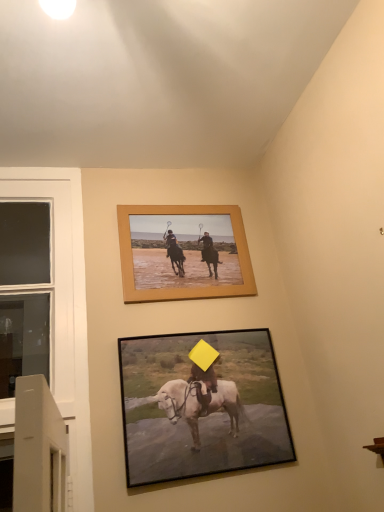
This screenshot has width=384, height=512. Describe the element at coordinates (201, 405) in the screenshot. I see `black matte picture frame at lower center, which is the first picture frame in bottom-to-top order` at that location.

Measure the distance between wooden frame at upper center, arranged as the second picture frame when ordered from the bottom, and camera.

wooden frame at upper center, arranged as the second picture frame when ordered from the bottom, is 1.41 meters away from camera.

I want to click on black matte picture frame at lower center, which is the first picture frame in bottom-to-top order, so click(x=201, y=405).

Is wooden frame at upper center, arranged as the second picture frame when ordered from the bottom, facing away from white glass window at left?

wooden frame at upper center, arranged as the second picture frame when ordered from the bottom, does not have its back to white glass window at left.

Is point (160, 288) in front of point (38, 289)?

Yes.

Is white glass window at left completely or partially inside wooden frame at upper center, the first picture frame positioned from the top?

No, white glass window at left is not inside wooden frame at upper center, the first picture frame positioned from the top.

Which object is positioned more to the left, wooden frame at upper center, the first picture frame positioned from the top, or white glass window at left?

white glass window at left.

In the scene shown: What's the angular difference between white glass window at left and black matte picture frame at lower center, the second picture frame positioned from the top,'s facing directions?

1.3 degrees.

Consider the image. From the image's perspective, between white glass window at left and black matte picture frame at lower center, which is the first picture frame in bottom-to-top order, who is located below?

black matte picture frame at lower center, which is the first picture frame in bottom-to-top order, from the image's perspective.

Which of these two, white glass window at left or black matte picture frame at lower center, which is the first picture frame in bottom-to-top order, stands shorter?

black matte picture frame at lower center, which is the first picture frame in bottom-to-top order, is shorter.

Which of these two, white glass window at left or black matte picture frame at lower center, the second picture frame positioned from the top, is thinner?

black matte picture frame at lower center, the second picture frame positioned from the top, is thinner.

From the image's perspective, is black matte picture frame at lower center, which is the first picture frame in bottom-to-top order, located above or below white glass window at left?

Clearly, from the image's perspective, black matte picture frame at lower center, which is the first picture frame in bottom-to-top order, is below white glass window at left.

Considering the sizes of objects black matte picture frame at lower center, which is the first picture frame in bottom-to-top order, and white glass window at left in the image provided, who is shorter, black matte picture frame at lower center, which is the first picture frame in bottom-to-top order, or white glass window at left?

Standing shorter between the two is black matte picture frame at lower center, which is the first picture frame in bottom-to-top order.

Is black matte picture frame at lower center, which is the first picture frame in bottom-to-top order, at the left side of wooden frame at upper center, the first picture frame positioned from the top?

No, black matte picture frame at lower center, which is the first picture frame in bottom-to-top order, is not to the left of wooden frame at upper center, the first picture frame positioned from the top.

Is there a large distance between black matte picture frame at lower center, which is the first picture frame in bottom-to-top order, and wooden frame at upper center, the first picture frame positioned from the top?

No.

Considering their positions, is black matte picture frame at lower center, which is the first picture frame in bottom-to-top order, located in front of or behind wooden frame at upper center, arranged as the second picture frame when ordered from the bottom?

Clearly, black matte picture frame at lower center, which is the first picture frame in bottom-to-top order, is in front of wooden frame at upper center, arranged as the second picture frame when ordered from the bottom.

From the image's perspective, relative to black matte picture frame at lower center, which is the first picture frame in bottom-to-top order, is wooden frame at upper center, arranged as the second picture frame when ordered from the bottom, above or below?

Based on their image positions, wooden frame at upper center, arranged as the second picture frame when ordered from the bottom, is located above black matte picture frame at lower center, which is the first picture frame in bottom-to-top order.

In the scene shown: Considering the relative positions of wooden frame at upper center, the first picture frame positioned from the top, and black matte picture frame at lower center, the second picture frame positioned from the top, in the image provided, is wooden frame at upper center, the first picture frame positioned from the top, in front of black matte picture frame at lower center, the second picture frame positioned from the top,?

No, the depth of wooden frame at upper center, the first picture frame positioned from the top, is greater than that of black matte picture frame at lower center, the second picture frame positioned from the top.

Looking at their sizes, would you say wooden frame at upper center, the first picture frame positioned from the top, is wider or thinner than black matte picture frame at lower center, which is the first picture frame in bottom-to-top order?

In the image, wooden frame at upper center, the first picture frame positioned from the top, appears to be more narrow than black matte picture frame at lower center, which is the first picture frame in bottom-to-top order.

In order to click on picture frame that is behind the black matte picture frame at lower center, which is the first picture frame in bottom-to-top order in this screenshot , I will do `click(183, 253)`.

Is white glass window at left aimed at wooden frame at upper center, the first picture frame positioned from the top?

No, white glass window at left is not facing towards wooden frame at upper center, the first picture frame positioned from the top.

Is white glass window at left positioned far away from wooden frame at upper center, arranged as the second picture frame when ordered from the bottom?

white glass window at left is actually quite close to wooden frame at upper center, arranged as the second picture frame when ordered from the bottom.

How different are the orientations of white glass window at left and wooden frame at upper center, arranged as the second picture frame when ordered from the bottom, in degrees?

There is a 0.581-degree angle between the facing directions of white glass window at left and wooden frame at upper center, arranged as the second picture frame when ordered from the bottom.

Which of these two, white glass window at left or wooden frame at upper center, arranged as the second picture frame when ordered from the bottom, stands taller?

With more height is white glass window at left.

The height and width of the screenshot is (512, 384). I want to click on picture frame behind the white glass window at left, so click(183, 253).

Locate an element on the screen. The image size is (384, 512). picture frame below the white glass window at left (from the image's perspective) is located at coordinates [201, 405].

Which object lies further to the anchor point white glass window at left, black matte picture frame at lower center, the second picture frame positioned from the top, or wooden frame at upper center, arranged as the second picture frame when ordered from the bottom?

black matte picture frame at lower center, the second picture frame positioned from the top.

Based on their spatial positions, is white glass window at left or wooden frame at upper center, the first picture frame positioned from the top, further from black matte picture frame at lower center, the second picture frame positioned from the top?

white glass window at left lies further to black matte picture frame at lower center, the second picture frame positioned from the top, than the other object.

Considering their positions, is black matte picture frame at lower center, the second picture frame positioned from the top, positioned closer to wooden frame at upper center, the first picture frame positioned from the top, than white glass window at left?

black matte picture frame at lower center, the second picture frame positioned from the top, is closer to wooden frame at upper center, the first picture frame positioned from the top.

Considering their positions, is wooden frame at upper center, the first picture frame positioned from the top, positioned further to black matte picture frame at lower center, which is the first picture frame in bottom-to-top order, than white glass window at left?

white glass window at left is further to black matte picture frame at lower center, which is the first picture frame in bottom-to-top order.

Which object lies further to the anchor point white glass window at left, wooden frame at upper center, arranged as the second picture frame when ordered from the bottom, or black matte picture frame at lower center, the second picture frame positioned from the top?

black matte picture frame at lower center, the second picture frame positioned from the top, is positioned further to the anchor white glass window at left.

Considering their positions, is white glass window at left positioned further to wooden frame at upper center, the first picture frame positioned from the top, than black matte picture frame at lower center, the second picture frame positioned from the top?

Based on the image, white glass window at left appears to be further to wooden frame at upper center, the first picture frame positioned from the top.

The image size is (384, 512). I want to click on picture frame between white glass window at left and black matte picture frame at lower center, the second picture frame positioned from the top, in the horizontal direction, so click(x=183, y=253).